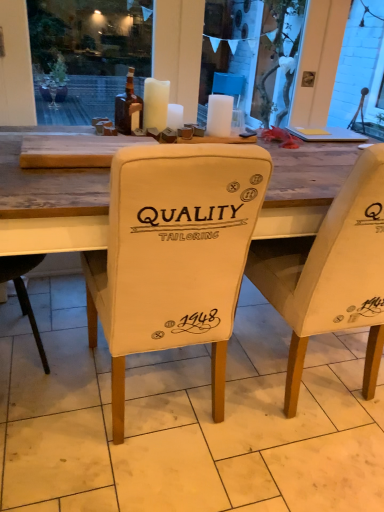
The width and height of the screenshot is (384, 512). What are the coordinates of `unoccupied area in front of beige fabric chair at center, the 1th chair positioned from the left` in the screenshot? It's located at (135, 480).